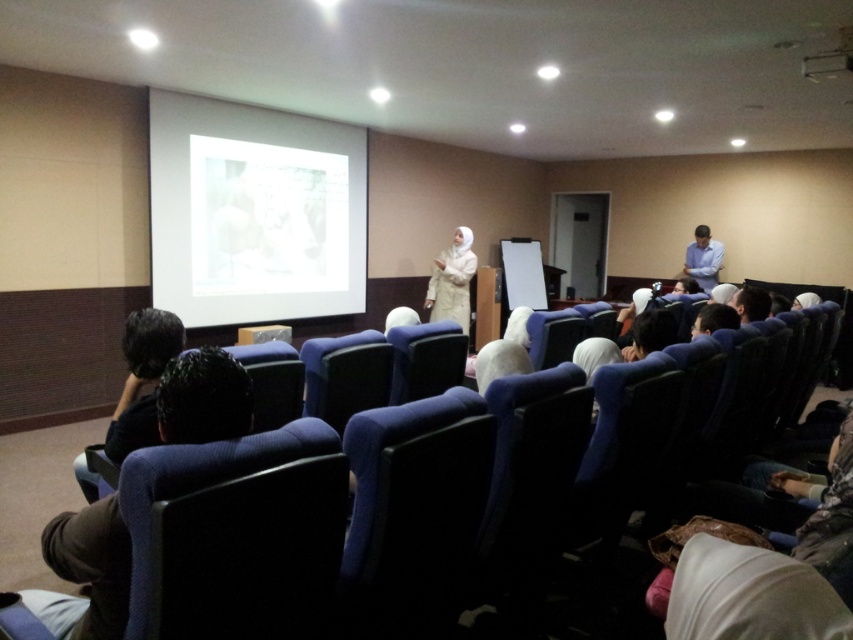
You are an attendee in the lecture hall and notice two elements at the lower left corner of the image. Which one is taller between the dark brown fabric at lower left and the dark hair at lower left?

The dark brown fabric at lower left is taller than the dark hair at lower left.